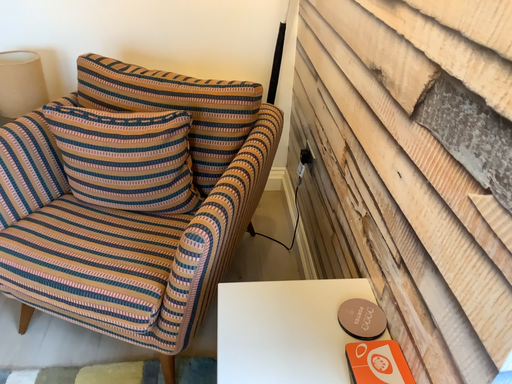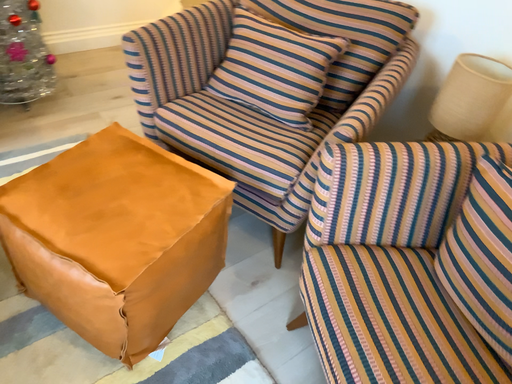
Question: How did the camera likely rotate when shooting the video?

Choices:
 (A) rotated downward
 (B) rotated upward

Answer: (B)